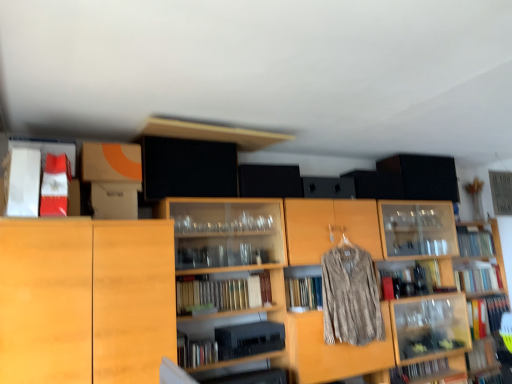
Where is `free point above hardcover books at center, positioned as the 3th book in top-to-bottom order (from a real-world perspective)`? The image size is (512, 384). free point above hardcover books at center, positioned as the 3th book in top-to-bottom order (from a real-world perspective) is located at coordinates (218, 278).